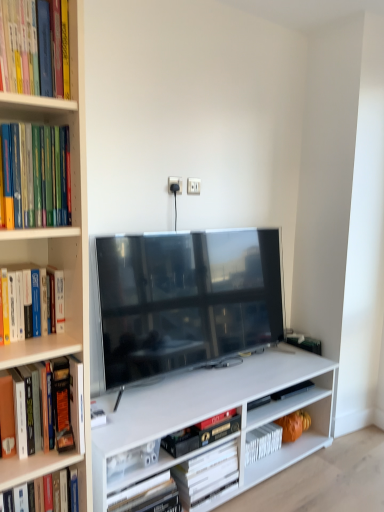
Question: Are hardcover book at lower center, the first book from the back, and hardcover book at upper left, which ranks as the fourth book in bottom-to-top order, located far from each other?

Choices:
 (A) yes
 (B) no

Answer: (A)

Question: Is hardcover book at upper left, the first book positioned from the front, completely or partially inside hardcover book at lower center, the 4th book viewed from the front?

Choices:
 (A) yes
 (B) no

Answer: (B)

Question: Considering the relative sizes of hardcover book at lower center, the 4th book viewed from the front, and hardcover book at upper left, which ranks as the 1th book in top-to-bottom order, in the image provided, is hardcover book at lower center, the 4th book viewed from the front, bigger than hardcover book at upper left, which ranks as the 1th book in top-to-bottom order,?

Choices:
 (A) no
 (B) yes

Answer: (B)

Question: Does hardcover book at lower center, the 1th book from the bottom, have a greater height compared to hardcover book at upper left, which ranks as the 1th book in top-to-bottom order?

Choices:
 (A) yes
 (B) no

Answer: (B)

Question: Is hardcover book at lower center, the 4th book viewed from the front, turned away from hardcover book at upper left, the first book positioned from the front?

Choices:
 (A) yes
 (B) no

Answer: (B)

Question: Does point (21, 76) appear closer or farther from the camera than point (218, 420)?

Choices:
 (A) farther
 (B) closer

Answer: (B)

Question: In the image, is hardcover book at upper left, the first book positioned from the front, on the left side or the right side of hardcover book at center, marked as the 3th book in a front-to-back arrangement?

Choices:
 (A) right
 (B) left

Answer: (B)

Question: In terms of height, does hardcover book at upper left, which ranks as the 1th book in top-to-bottom order, look taller or shorter compared to hardcover book at center, marked as the 3th book in a front-to-back arrangement?

Choices:
 (A) short
 (B) tall

Answer: (B)

Question: Is hardcover book at upper left, which ranks as the 1th book in top-to-bottom order, wider or thinner than hardcover book at center, which is the 2th book in back-to-front order?

Choices:
 (A) wide
 (B) thin

Answer: (A)

Question: From a real-world perspective, is hardcover books at left, positioned as the 2th book in top-to-bottom order, positioned above or below hardcover book at lower center, the 4th book viewed from the front?

Choices:
 (A) above
 (B) below

Answer: (A)

Question: Based on their positions, is hardcover books at left, the second book from the front, located to the left or right of hardcover book at lower center, the 4th book viewed from the front?

Choices:
 (A) right
 (B) left

Answer: (B)

Question: From the image's perspective, relative to hardcover book at lower center, the first book from the back, is hardcover books at left, positioned as the 2th book in top-to-bottom order, above or below?

Choices:
 (A) above
 (B) below

Answer: (A)

Question: Considering their positions, is hardcover books at left, which ranks as the 3th book in bottom-to-top order, located in front of or behind hardcover book at lower center, the 1th book from the bottom?

Choices:
 (A) front
 (B) behind

Answer: (A)

Question: Relative to hardcover books at left, the second book from the front, is matte black tv at center in front or behind?

Choices:
 (A) behind
 (B) front

Answer: (A)

Question: Would you say matte black tv at center is inside or outside hardcover books at left, which ranks as the 3th book in bottom-to-top order?

Choices:
 (A) outside
 (B) inside

Answer: (A)